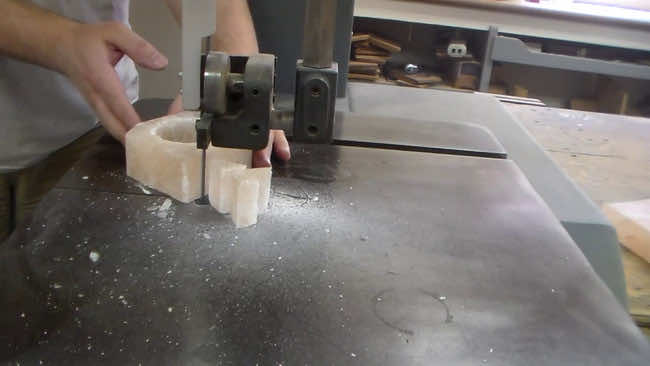
Where is `table`? This screenshot has height=366, width=650. table is located at coordinates (391, 238).